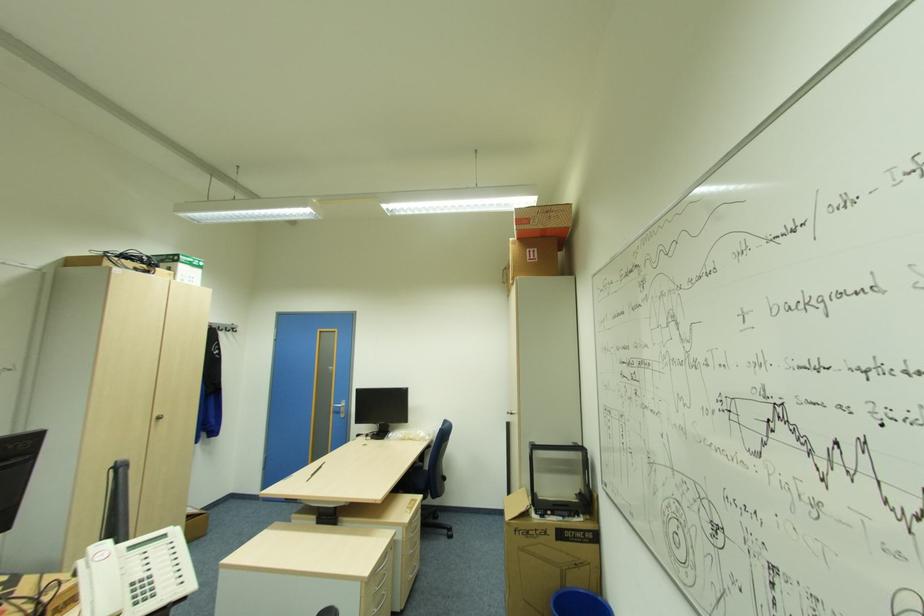
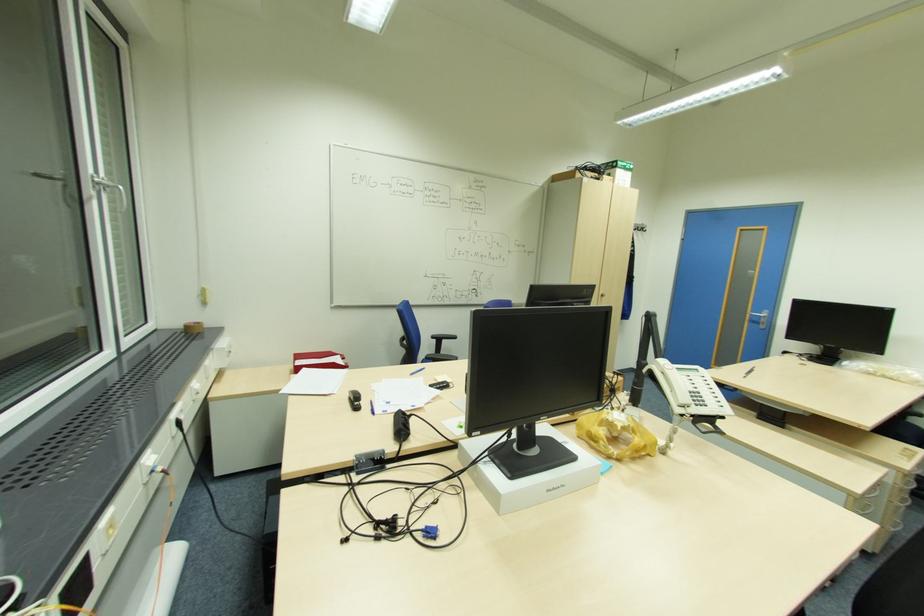
In the second image, find the point that corresponds to pixel 345 411 in the first image.

(766, 323)